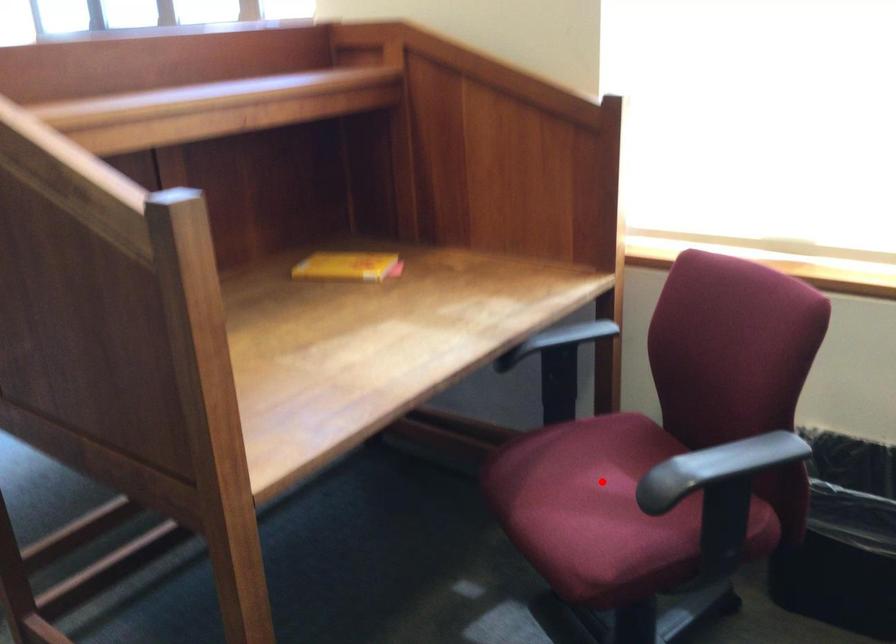
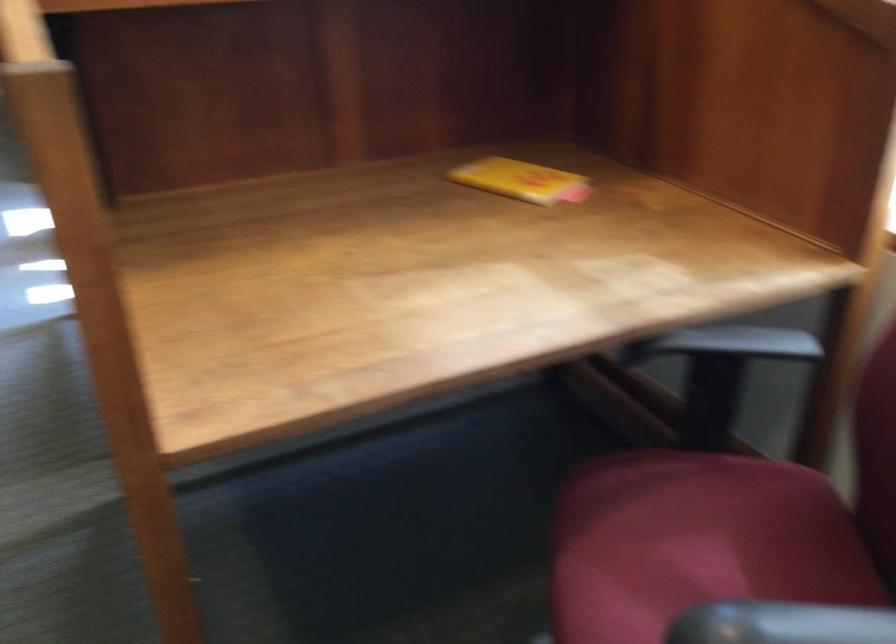
Question: I am providing you with two images of the same scene from different viewpoints. Image1 has a red point marked. In image2, the corresponding 3D location appears at what relative position? Reply with the corresponding letter.

Choices:
 (A) Closer
 (B) Farther

Answer: (A)